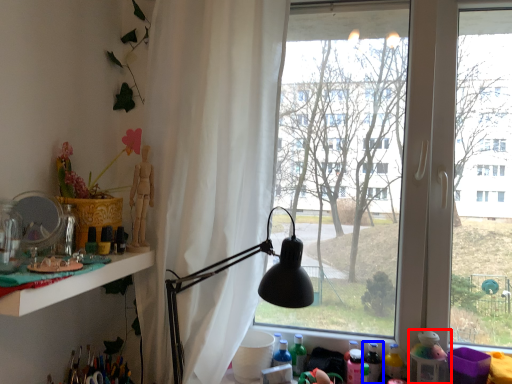
Question: Among these objects, which one is farthest to the camera, toy (highlighted by a red box) or bottle (highlighted by a blue box)?

Choices:
 (A) toy
 (B) bottle

Answer: (B)